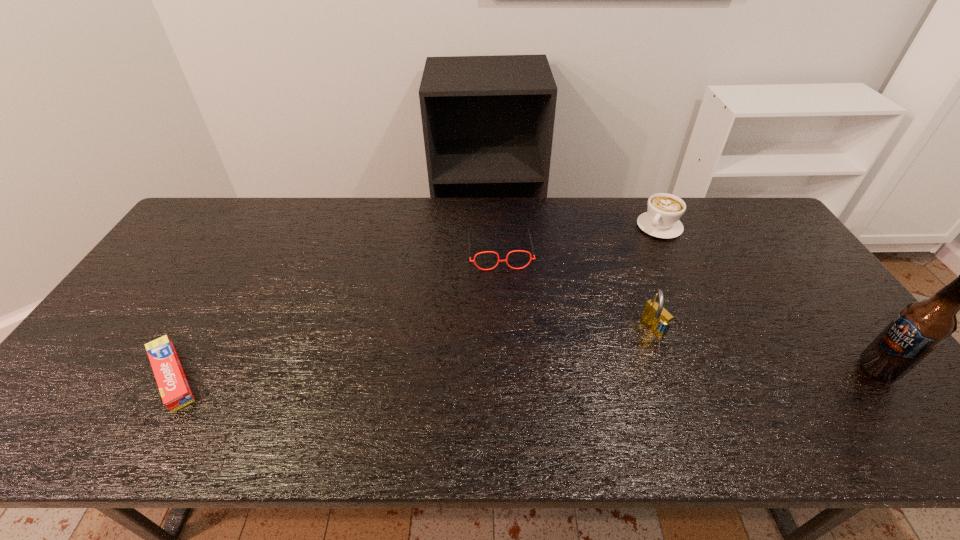
Locate an element on the screen. The width and height of the screenshot is (960, 540). object present at the near right corner is located at coordinates (920, 327).

Find the location of `free region at the far edge`. free region at the far edge is located at coordinates (473, 232).

Find the location of a particular element. The width and height of the screenshot is (960, 540). blank area at the near edge is located at coordinates (291, 396).

The height and width of the screenshot is (540, 960). Identify the location of vacant region at the right edge of the desktop. (839, 339).

The height and width of the screenshot is (540, 960). I want to click on blank region between the fourth tallest object and the padlock, so click(577, 288).

Locate an element on the screen. The width and height of the screenshot is (960, 540). free area in between the third object from left to right and the shortest object is located at coordinates (413, 351).

You are a GUI agent. You are given a task and a screenshot of the screen. Output one action in this format:
    pyautogui.click(x=<x>, y=<y>)
    Task: Click on the free space between the cappuccino and the padlock
    The width and height of the screenshot is (960, 540).
    Given the screenshot: What is the action you would take?
    pyautogui.click(x=657, y=276)

This screenshot has height=540, width=960. I want to click on free space that is in between the second object from left to right and the leftmost object, so click(336, 313).

I want to click on vacant point located between the third farthest object and the spectacles, so click(577, 288).

The height and width of the screenshot is (540, 960). I want to click on vacant point located between the second shortest object and the shortest object, so point(336,313).